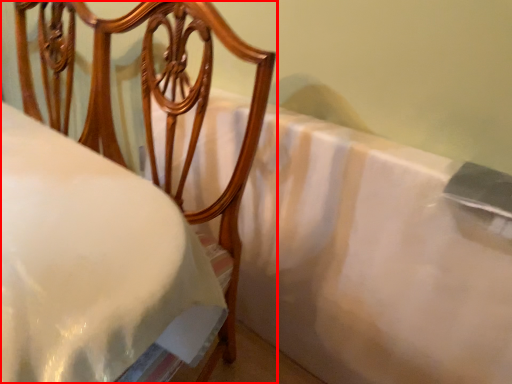
Question: From the image's perspective, where is furniture (annotated by the red box) located relative to sheet?

Choices:
 (A) below
 (B) above

Answer: (B)